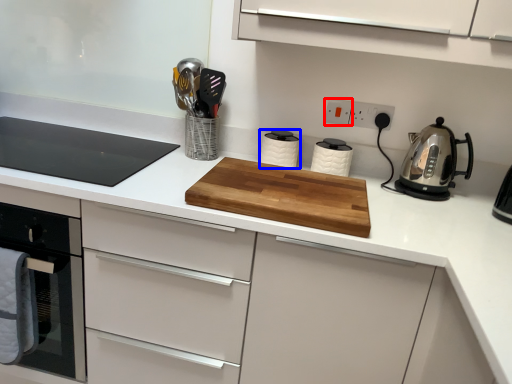
Question: Which object appears farthest to the camera in this image, electric outlet (highlighted by a red box) or kitchen appliance (highlighted by a blue box)?

Choices:
 (A) electric outlet
 (B) kitchen appliance

Answer: (A)